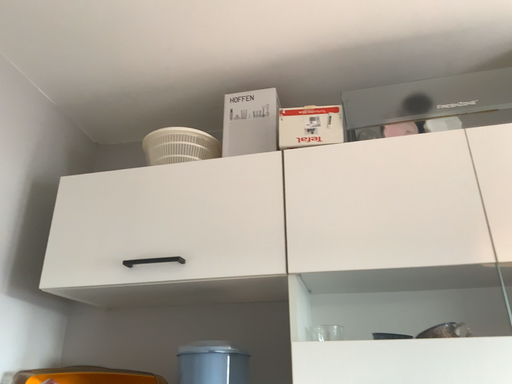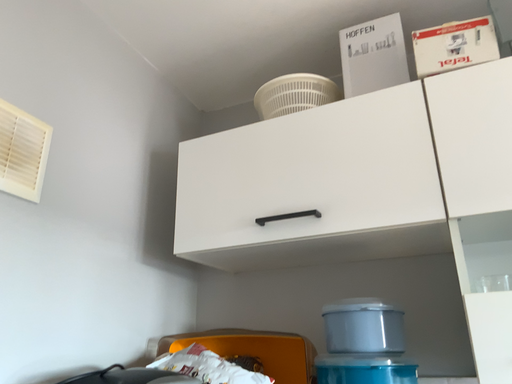
Question: How did the camera likely rotate when shooting the video?

Choices:
 (A) rotated right
 (B) rotated left

Answer: (B)